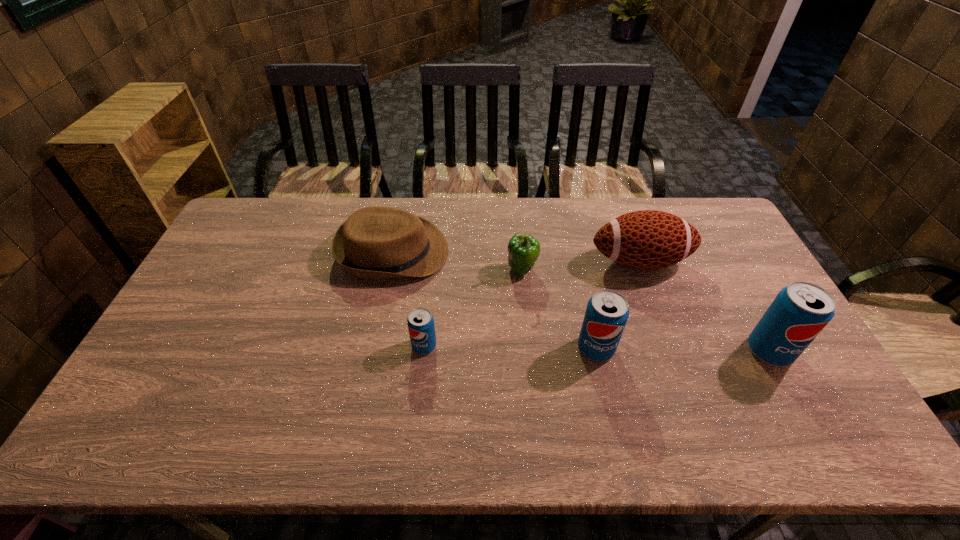
At what (x,y) coordinates should I click in order to perform the action: click on free spot between the fourth object from right to left and the football. Please return your answer as a coordinate pair (x, y). This screenshot has width=960, height=540. Looking at the image, I should click on (581, 266).

Identify the location of unoccupied position between the shortest soda can and the fedora. Image resolution: width=960 pixels, height=540 pixels. (409, 299).

Locate an element on the screen. This screenshot has height=540, width=960. free space between the third object from left to right and the second tallest soda can is located at coordinates (559, 309).

Identify the location of vacant space that is in between the fedora and the shortest soda can. (409, 299).

The height and width of the screenshot is (540, 960). In order to click on free space between the bell pepper and the rightmost soda can in this screenshot , I will do `click(646, 310)`.

At what (x,y) coordinates should I click in order to perform the action: click on free spot between the football and the rightmost object. Please return your answer as a coordinate pair (x, y). Image resolution: width=960 pixels, height=540 pixels. Looking at the image, I should click on (705, 306).

At what (x,y) coordinates should I click in order to perform the action: click on blank region between the bell pepper and the football. Please return your answer as a coordinate pair (x, y). The width and height of the screenshot is (960, 540). Looking at the image, I should click on (581, 266).

This screenshot has width=960, height=540. Identify the location of object that is the third closest to the rightmost object. (523, 250).

At what (x,y) coordinates should I click in order to perform the action: click on object that stands as the fourth closest to the football. Please return your answer as a coordinate pair (x, y). The image size is (960, 540). Looking at the image, I should click on (376, 242).

Where is `soda can that stands as the second closest to the rightmost soda can`? soda can that stands as the second closest to the rightmost soda can is located at coordinates (420, 321).